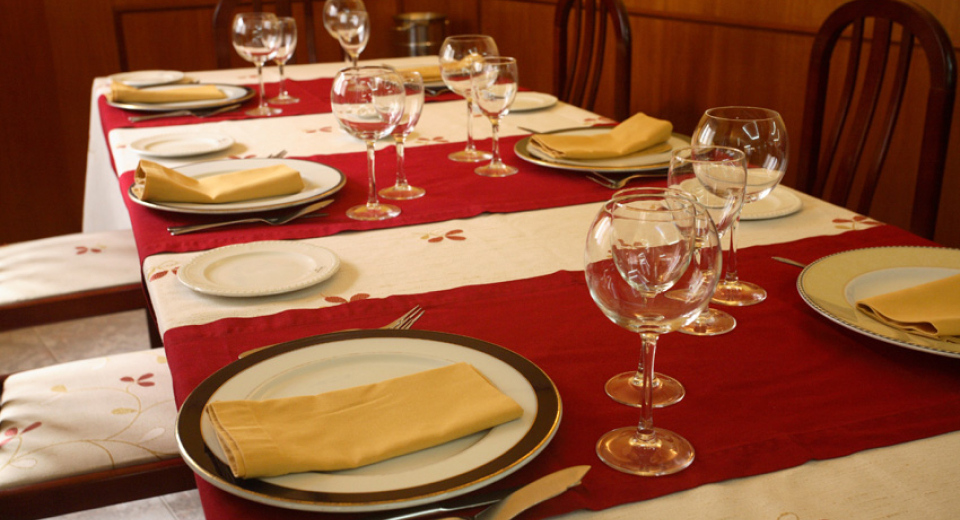
This screenshot has height=520, width=960. What are the coordinates of `chairs` in the screenshot? It's located at (93, 425), (52, 259), (818, 92), (621, 37).